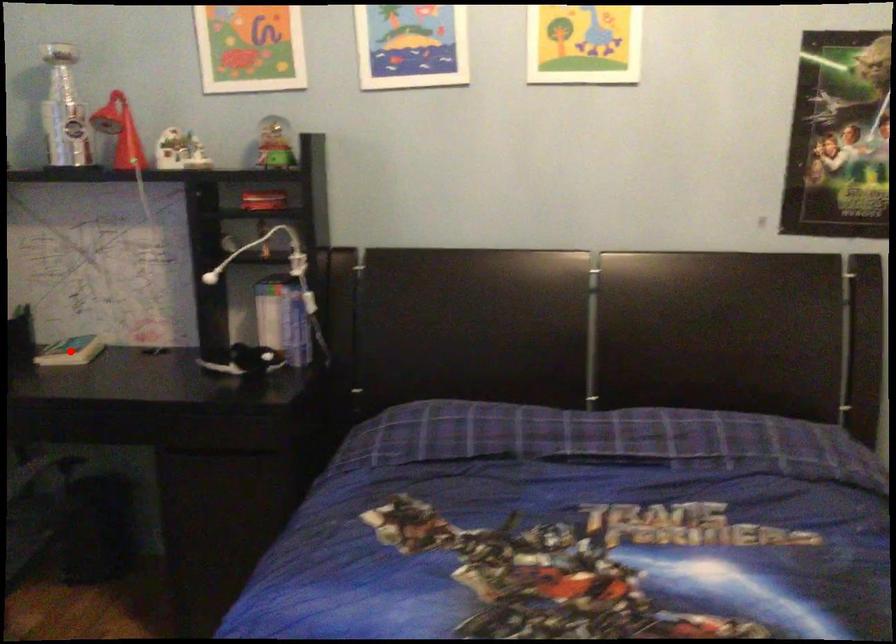
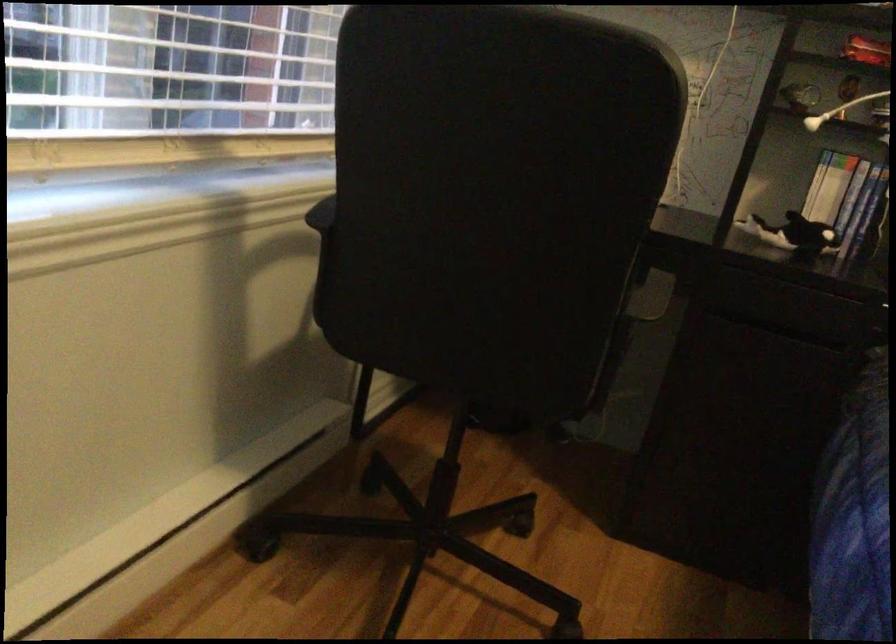
Question: I am providing you with two images of the same scene from different viewpoints. A red point is marked on the first image. Is the red point's position out of view in image 2?

Choices:
 (A) Yes
 (B) No

Answer: (A)